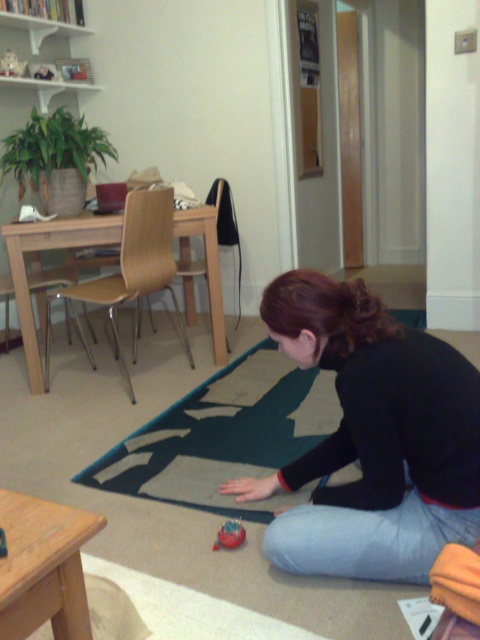
Consider the image. You are trying to place the rubberized red toy at lower left on the wooden stool at lower left. Based on their sizes, will the toy fit on the stool without falling off?

The wooden stool at lower left is wider than the rubberized red toy at lower left, so the toy will fit and stay on the stool.

You are a delivery person trying to place a package that is 2.5 feet wide on the floor near the wooden stool at lower left. Based on the scene, can you fit the package without moving the stool?

The wooden stool at lower left is 31.64 inches from the camera. Since 2.5 feet is 30 inches, the package is slightly wider than the distance from the stool to the camera. Therefore, placing the package near the stool may not leave enough space, so it might not fit without moving the stool.